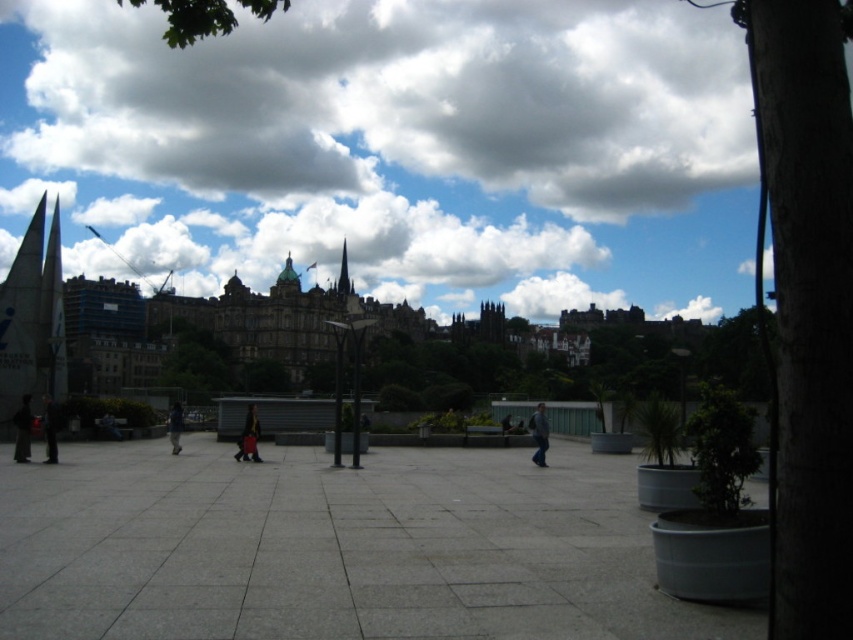
Is cloudy sky at upper center bigger than dark gray jacket at left?

Correct, cloudy sky at upper center is larger in size than dark gray jacket at left.

Which is in front, point (106, 170) or point (48, 413)?

Point (48, 413) is in front.

Image resolution: width=853 pixels, height=640 pixels. What are the coordinates of `cloudy sky at upper center` in the screenshot? It's located at (399, 147).

From the picture: Can you confirm if dark gray jacket at left is taller than dark blue jeans at center?

Yes.

Is point (49, 417) closer to viewer compared to point (177, 438)?

Yes, point (49, 417) is closer to viewer.

Describe the element at coordinates (50, 428) in the screenshot. Image resolution: width=853 pixels, height=640 pixels. I see `dark gray jacket at left` at that location.

Where is `dark gray jacket at left`? This screenshot has width=853, height=640. dark gray jacket at left is located at coordinates (50, 428).

Which is more to the left, blue denim jacket at center or dark gray stone spire at center?

dark gray stone spire at center is more to the left.

Can you confirm if blue denim jacket at center is bigger than dark gray stone spire at center?

Actually, blue denim jacket at center might be smaller than dark gray stone spire at center.

Which is behind, point (544, 451) or point (345, 268)?

Point (345, 268)

This screenshot has height=640, width=853. Find the location of `blue denim jacket at center`. blue denim jacket at center is located at coordinates (538, 435).